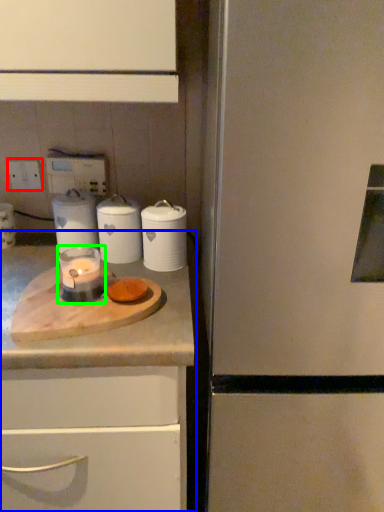
Question: Estimate the real-world distances between objects in this image. Which object is closer to electric outlet (highlighted by a red box), countertop (highlighted by a blue box) or candle holder (highlighted by a green box)?

Choices:
 (A) countertop
 (B) candle holder

Answer: (B)